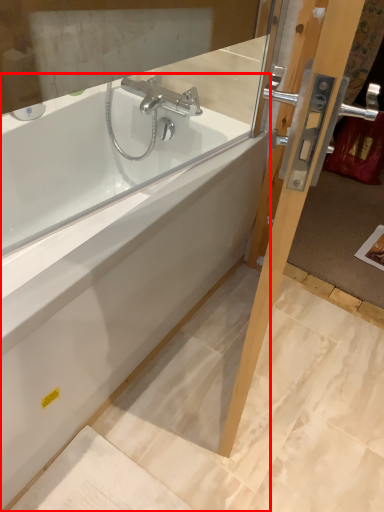
Question: From the image's perspective, where is bathtub (annotated by the red box) located in relation to screen door in the image?

Choices:
 (A) below
 (B) above

Answer: (A)